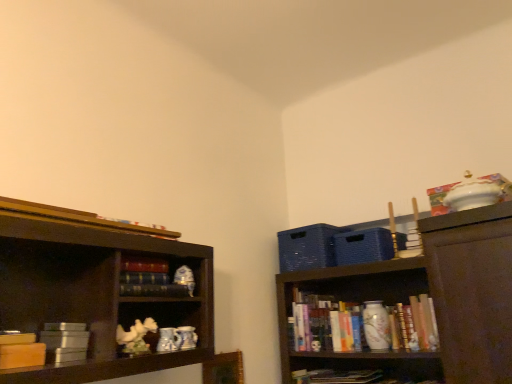
Locate an element on the screen. The width and height of the screenshot is (512, 384). hardcover book at center, marked as the fifth book in a top-to-bottom arrangement is located at coordinates (349, 377).

In the scene shown: Measure the distance between hardcover book at upper left, placed as the fifth book when sorted from bottom to top, and camera.

hardcover book at upper left, placed as the fifth book when sorted from bottom to top, and camera are 1.10 meters apart from each other.

You are a GUI agent. You are given a task and a screenshot of the screen. Output one action in this format:
    pyautogui.click(x=<x>, y=<y>)
    Task: Click on the metallic silver book at lower left, arranged as the 2th book when viewed from the left
    The height and width of the screenshot is (384, 512).
    Given the screenshot: What is the action you would take?
    pyautogui.click(x=64, y=342)

You are a GUI agent. You are given a task and a screenshot of the screen. Output one action in this format:
    pyautogui.click(x=<x>, y=<y>)
    Task: Click on the black matte bookshelf at center, the fourth book in the bottom-to-top sequence
    
    Given the screenshot: What is the action you would take?
    pyautogui.click(x=156, y=290)

Image resolution: width=512 pixels, height=384 pixels. What are the coordinates of `the 2nd book counting from the left side of the black matte bookshelf at center, which is counted as the 2th book, starting from the back` in the screenshot? It's located at (64, 342).

Is black matte bookshelf at center, positioned as the second book in top-to-bottom order, at the back of metallic silver book at lower left, the 4th book when ordered from right to left?

No, metallic silver book at lower left, the 4th book when ordered from right to left, is not facing the opposite direction of black matte bookshelf at center, positioned as the second book in top-to-bottom order.

From the image's perspective, which object appears higher, metallic silver book at lower left, the 4th book when ordered from right to left, or black matte bookshelf at center, the fourth book in the bottom-to-top sequence?

black matte bookshelf at center, the fourth book in the bottom-to-top sequence.

Between metallic silver book at lower left, which ranks as the 4th book in top-to-bottom order, and hardcover book at upper left, marked as the third book in a right-to-left arrangement, which one is positioned behind?

Positioned behind is metallic silver book at lower left, which ranks as the 4th book in top-to-bottom order.

Between metallic silver book at lower left, which is the 3th book in front-to-back order, and hardcover book at upper left, placed as the fifth book when sorted from bottom to top, which one has more height?

metallic silver book at lower left, which is the 3th book in front-to-back order, is taller.

Is metallic silver book at lower left, marked as the 2th book in a bottom-to-top arrangement, aimed at hardcover book at upper left, which is the first book from top to bottom?

No, metallic silver book at lower left, marked as the 2th book in a bottom-to-top arrangement, does not turn towards hardcover book at upper left, which is the first book from top to bottom.

From a real-world perspective, is metallic silver book at lower left, arranged as the 2th book when viewed from the left, on hardcover book at upper left, the first book from the front?

No, from a real-world perspective, metallic silver book at lower left, arranged as the 2th book when viewed from the left, is not over hardcover book at upper left, the first book from the front

From a real-world perspective, is hardcover book at upper left, arranged as the 5th book when viewed from the back, located beneath matte yellow book at left, which is counted as the 3th book, starting from the top?

No, from a real-world perspective, hardcover book at upper left, arranged as the 5th book when viewed from the back, is not below matte yellow book at left, which is counted as the 3th book, starting from the top.

From the image's perspective, is hardcover book at upper left, placed as the fifth book when sorted from bottom to top, beneath matte yellow book at left, placed as the third book when sorted from bottom to top?

Incorrect, from the image's perspective, hardcover book at upper left, placed as the fifth book when sorted from bottom to top, is higher than matte yellow book at left, placed as the third book when sorted from bottom to top.

Between hardcover book at upper left, marked as the third book in a right-to-left arrangement, and matte yellow book at left, which is counted as the 3th book, starting from the top, which one is positioned in front?

hardcover book at upper left, marked as the third book in a right-to-left arrangement, is closer to the camera.

Between hardcover book at upper left, marked as the third book in a right-to-left arrangement, and matte yellow book at left, placed as the third book when sorted from bottom to top, which one has larger size?

Bigger between the two is hardcover book at upper left, marked as the third book in a right-to-left arrangement.

Is metallic silver book at lower left, marked as the 3th book in a back-to-front arrangement, outside of matte yellow book at left, placed as the third book when sorted from bottom to top?

Yes.

From the image's perspective, is metallic silver book at lower left, the 4th book when ordered from right to left, above matte yellow book at left, placed as the second book when sorted from front to back?

Actually, metallic silver book at lower left, the 4th book when ordered from right to left, appears below matte yellow book at left, placed as the second book when sorted from front to back, in the image.

Find the location of a particular element. the 1st book positioned below the metallic silver book at lower left, which is the 3th book in front-to-back order (from a real-world perspective) is located at coordinates (21, 351).

From a real-world perspective, between metallic silver book at lower left, arranged as the 2th book when viewed from the left, and matte yellow book at left, which is counted as the 3th book, starting from the top, who is vertically lower?

matte yellow book at left, which is counted as the 3th book, starting from the top, from a real-world perspective.

Which is behind, point (333, 372) or point (133, 294)?

The point (333, 372) is more distant.

Is black matte bookshelf at center, positioned as the second book in top-to-bottom order, at the back of hardcover book at center, which appears as the first book when ordered from the bottom?

No, hardcover book at center, which appears as the first book when ordered from the bottom, is not facing away from black matte bookshelf at center, positioned as the second book in top-to-bottom order.

Is hardcover book at center, positioned as the fifth book in left-to-right order, spatially inside black matte bookshelf at center, positioned as the second book in top-to-bottom order, or outside of it?

hardcover book at center, positioned as the fifth book in left-to-right order, cannot be found inside black matte bookshelf at center, positioned as the second book in top-to-bottom order.

From the image's perspective, which one is positioned lower, hardcover book at center, placed as the first book when sorted from right to left, or black matte bookshelf at center, placed as the 4th book when sorted from left to right?

hardcover book at center, placed as the first book when sorted from right to left.

Is matte yellow book at left, the first book in the left-to-right sequence, bigger than metallic silver book at lower left, marked as the 2th book in a bottom-to-top arrangement?

Actually, matte yellow book at left, the first book in the left-to-right sequence, might be smaller than metallic silver book at lower left, marked as the 2th book in a bottom-to-top arrangement.

Does matte yellow book at left, placed as the third book when sorted from bottom to top, have a lesser height compared to metallic silver book at lower left, the 4th book when ordered from right to left?

Yes, matte yellow book at left, placed as the third book when sorted from bottom to top, is shorter than metallic silver book at lower left, the 4th book when ordered from right to left.

From a real-world perspective, is matte yellow book at left, which is counted as the 3th book, starting from the top, positioned above or below metallic silver book at lower left, which ranks as the 4th book in top-to-bottom order?

matte yellow book at left, which is counted as the 3th book, starting from the top, is below metallic silver book at lower left, which ranks as the 4th book in top-to-bottom order.

Is point (3, 342) less distant than point (51, 357)?

Yes, it is in front of point (51, 357).

From a real-world perspective, who is located lower, black matte bookshelf at center, which is counted as the fourth book, starting from the front, or hardcover book at center, placed as the first book when sorted from right to left?

hardcover book at center, placed as the first book when sorted from right to left, is physically lower.

Would you say black matte bookshelf at center, positioned as the second book in top-to-bottom order, is outside hardcover book at center, acting as the 5th book starting from the front?

Absolutely, black matte bookshelf at center, positioned as the second book in top-to-bottom order, is external to hardcover book at center, acting as the 5th book starting from the front.

From the image's perspective, is black matte bookshelf at center, which is counted as the fourth book, starting from the front, located above hardcover book at center, acting as the 5th book starting from the front?

Correct, black matte bookshelf at center, which is counted as the fourth book, starting from the front, appears higher than hardcover book at center, acting as the 5th book starting from the front, in the image.

I want to click on the 3rd book below the black matte bookshelf at center, which is counted as the 2th book, starting from the right (from the image's perspective), so click(349, 377).

Identify the location of the 2nd book below when counting from the black matte bookshelf at center, positioned as the second book in top-to-bottom order (from the image's perspective). The width and height of the screenshot is (512, 384). (64, 342).

From a real-world perspective, which book is the 2nd one above the metallic silver book at lower left, marked as the 3th book in a back-to-front arrangement? Please provide its 2D coordinates.

[(79, 218)]

Looking at the image, which one is located further to black matte bookshelf at center, which is counted as the 2th book, starting from the back, hardcover book at upper left, placed as the fifth book when sorted from bottom to top, or matte yellow book at left, which is the fourth book from back to front?

matte yellow book at left, which is the fourth book from back to front, lies further to black matte bookshelf at center, which is counted as the 2th book, starting from the back, than the other object.

Based on their spatial positions, is hardcover book at upper left, which is counted as the 3th book, starting from the left, or matte yellow book at left, arranged as the fifth book when viewed from the right, further from metallic silver book at lower left, which is the 3th book in front-to-back order?

hardcover book at upper left, which is counted as the 3th book, starting from the left.

Based on their spatial positions, is metallic silver book at lower left, marked as the 2th book in a bottom-to-top arrangement, or hardcover book at center, positioned as the fifth book in left-to-right order, closer to black matte bookshelf at center, which is counted as the 2th book, starting from the back?

Among the two, metallic silver book at lower left, marked as the 2th book in a bottom-to-top arrangement, is located nearer to black matte bookshelf at center, which is counted as the 2th book, starting from the back.

Based on their spatial positions, is hardcover book at upper left, placed as the fifth book when sorted from bottom to top, or hardcover book at center, acting as the 5th book starting from the front, closer to matte yellow book at left, which is the fourth book from back to front?

The object closer to matte yellow book at left, which is the fourth book from back to front, is hardcover book at upper left, placed as the fifth book when sorted from bottom to top.

Based on their spatial positions, is hardcover book at center, marked as the fifth book in a top-to-bottom arrangement, or matte yellow book at left, the first book in the left-to-right sequence, closer to metallic silver book at lower left, marked as the 3th book in a back-to-front arrangement?

The object closer to metallic silver book at lower left, marked as the 3th book in a back-to-front arrangement, is matte yellow book at left, the first book in the left-to-right sequence.

From the picture: Which object lies nearer to the anchor point hardcover book at center, placed as the 1th book when sorted from back to front, matte yellow book at left, which is counted as the 3th book, starting from the top, or metallic silver book at lower left, which is the 3th book in front-to-back order?

metallic silver book at lower left, which is the 3th book in front-to-back order.

Looking at the image, which one is located further to matte yellow book at left, which is the fourth book from back to front, black matte bookshelf at center, placed as the 4th book when sorted from left to right, or hardcover book at center, placed as the 1th book when sorted from back to front?

hardcover book at center, placed as the 1th book when sorted from back to front.

Estimate the real-world distances between objects in this image. Which object is further from hardcover book at upper left, marked as the third book in a right-to-left arrangement, matte yellow book at left, which is the fourth book from back to front, or metallic silver book at lower left, marked as the 3th book in a back-to-front arrangement?

matte yellow book at left, which is the fourth book from back to front, is positioned further to the anchor hardcover book at upper left, marked as the third book in a right-to-left arrangement.

Find the location of a particular element. The height and width of the screenshot is (384, 512). book between hardcover book at upper left, which is counted as the 3th book, starting from the left, and matte yellow book at left, placed as the third book when sorted from bottom to top, from top to bottom is located at coordinates (156, 290).